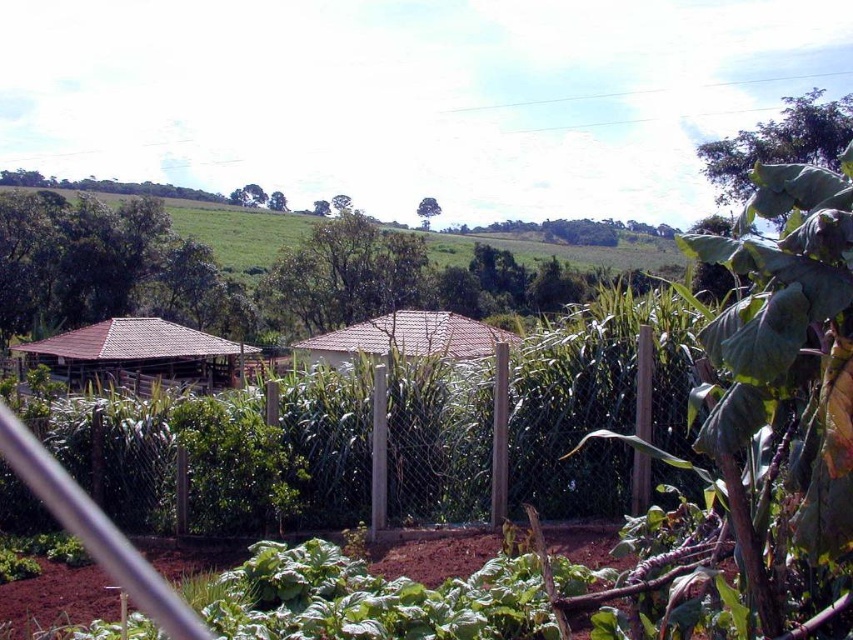
Can you confirm if wooden fence at center is shorter than brown tile hut at center?

Yes.

Between wooden fence at center and brown tile hut at center, which one is positioned higher?

brown tile hut at center is higher up.

Is point (399, 499) positioned behind point (370, 320)?

No.

Identify the location of wooden fence at center. (570, 422).

Between brown wooden hut at left and brown tile hut at center, which one appears on the right side from the viewer's perspective?

From the viewer's perspective, brown tile hut at center appears more on the right side.

Does brown wooden hut at left come behind brown tile hut at center?

Yes, it is behind brown tile hut at center.

Between point (68, 356) and point (387, 321), which one is positioned behind?

The point (387, 321) is behind.

Locate an element on the screen. The height and width of the screenshot is (640, 853). brown wooden hut at left is located at coordinates (138, 355).

Does wooden fence at center appear under brown wooden hut at left?

Yes.

Can you confirm if wooden fence at center is positioned to the right of brown wooden hut at left?

Yes, wooden fence at center is to the right of brown wooden hut at left.

Is point (422, 492) more distant than point (82, 364)?

No, (422, 492) is closer to viewer.

You are a GUI agent. You are given a task and a screenshot of the screen. Output one action in this format:
    pyautogui.click(x=<x>, y=<y>)
    Task: Click on the wooden fence at center
    The width and height of the screenshot is (853, 640).
    Given the screenshot: What is the action you would take?
    pyautogui.click(x=570, y=422)